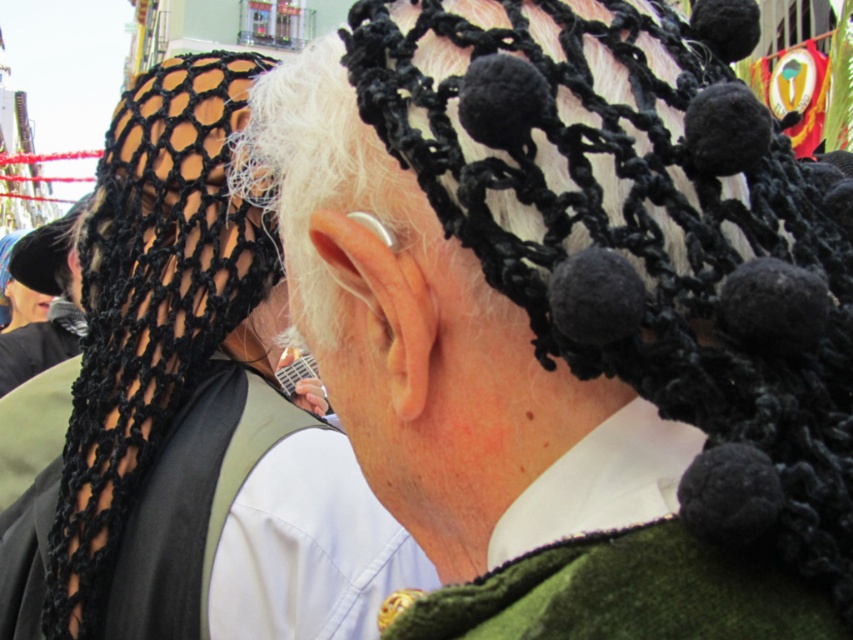
You are a fashion designer observing the two headpieces in the image. Which one can you wear to cover more of your head, the black knitted hat at center or the black mesh headscarf at upper left?

The black knitted hat at center is bigger than the black mesh headscarf at upper left, so it can cover more of your head.

You are standing in front of the image and want to touch the two points marked in the scene. Which point, point (569, 445) or point (85, 436), would you reach first if you move your hand forward?

Point (569, 445) is closer to the viewer than point (85, 436), so you would reach point (569, 445) first.